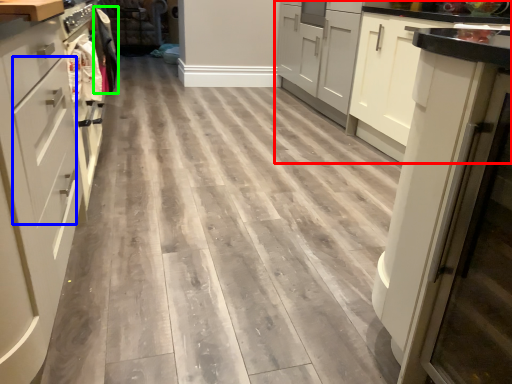
Question: Considering the real-world distances, which object is closest to cabinetry (highlighted by a red box)? drawer (highlighted by a blue box) or laundry (highlighted by a green box).

Choices:
 (A) drawer
 (B) laundry

Answer: (B)